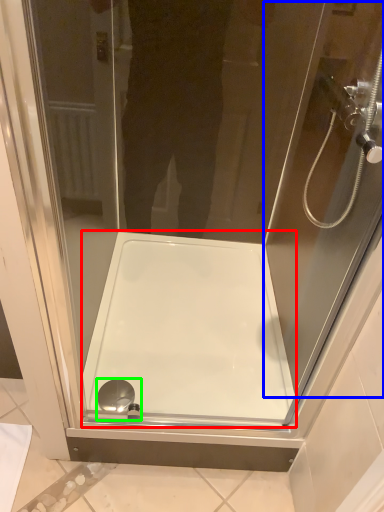
Question: Based on their relative distances, which object is farther from bath (highlighted by a red box)? Choose from screen door (highlighted by a blue box) and shower (highlighted by a green box).

Choices:
 (A) screen door
 (B) shower

Answer: (A)